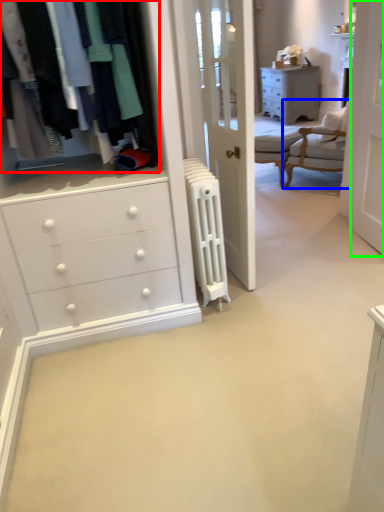
Question: Considering the real-world distances, which object is farthest from closet (highlighted by a red box)? chair (highlighted by a blue box) or screen door (highlighted by a green box)?

Choices:
 (A) chair
 (B) screen door

Answer: (A)